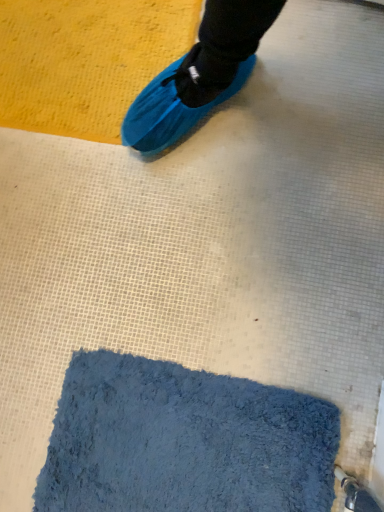
The height and width of the screenshot is (512, 384). Identify the location of free space above blue fuzzy bath mat at lower center (from a real-world perspective). (232, 474).